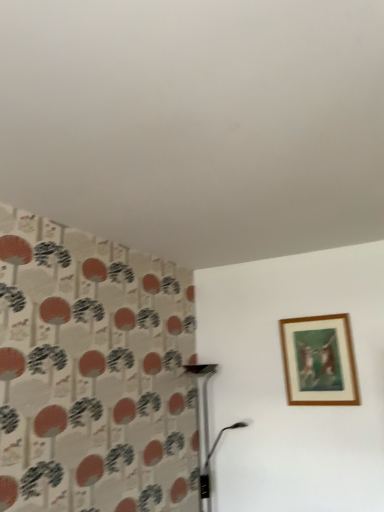
Question: From a real-world perspective, does wooden frame at upper right sit lower than metallic silver table lamp at lower center?

Choices:
 (A) no
 (B) yes

Answer: (A)

Question: Is wooden frame at upper right looking in the opposite direction of metallic silver table lamp at lower center?

Choices:
 (A) no
 (B) yes

Answer: (A)

Question: Considering the relative positions of wooden frame at upper right and metallic silver table lamp at lower center in the image provided, is wooden frame at upper right to the right of metallic silver table lamp at lower center from the viewer's perspective?

Choices:
 (A) yes
 (B) no

Answer: (A)

Question: From the image's perspective, would you say wooden frame at upper right is shown under metallic silver table lamp at lower center?

Choices:
 (A) yes
 (B) no

Answer: (B)

Question: From a real-world perspective, is wooden frame at upper right on metallic silver table lamp at lower center?

Choices:
 (A) no
 (B) yes

Answer: (B)

Question: Is wooden frame at upper right to the left of metallic silver table lamp at lower center from the viewer's perspective?

Choices:
 (A) yes
 (B) no

Answer: (B)

Question: Can you confirm if metallic silver table lamp at lower center is smaller than wooden frame at upper right?

Choices:
 (A) yes
 (B) no

Answer: (B)

Question: From a real-world perspective, is metallic silver table lamp at lower center on wooden frame at upper right?

Choices:
 (A) yes
 (B) no

Answer: (B)

Question: Is metallic silver table lamp at lower center further to the viewer compared to wooden frame at upper right?

Choices:
 (A) no
 (B) yes

Answer: (A)

Question: Considering the relative sizes of metallic silver table lamp at lower center and wooden frame at upper right in the image provided, is metallic silver table lamp at lower center bigger than wooden frame at upper right?

Choices:
 (A) yes
 (B) no

Answer: (A)

Question: Does metallic silver table lamp at lower center have a lesser width compared to wooden frame at upper right?

Choices:
 (A) yes
 (B) no

Answer: (B)

Question: Is metallic silver table lamp at lower center facing away from wooden frame at upper right?

Choices:
 (A) no
 (B) yes

Answer: (A)

Question: Based on their sizes in the image, would you say metallic silver table lamp at lower center is bigger or smaller than wooden frame at upper right?

Choices:
 (A) big
 (B) small

Answer: (A)